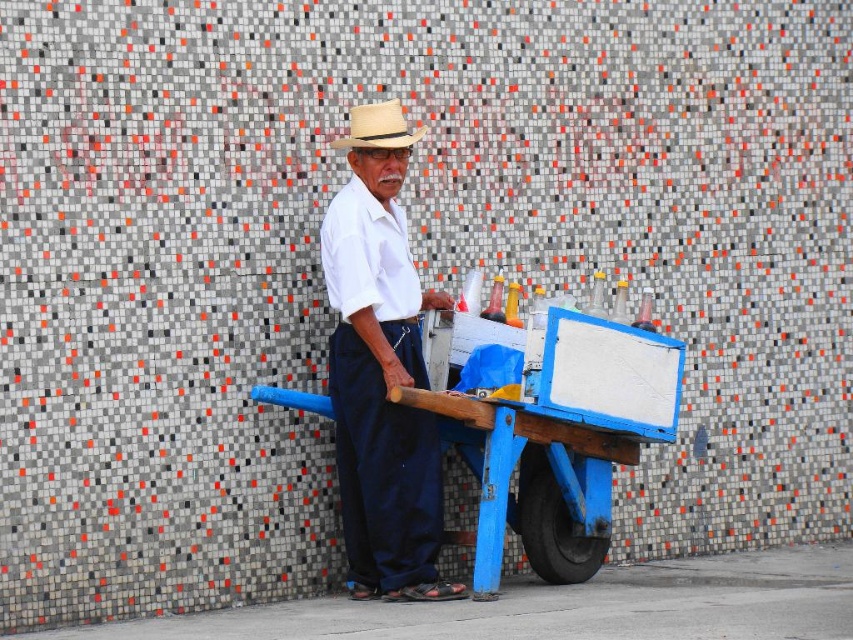
Question: Which point is farther to the camera?

Choices:
 (A) (343, 148)
 (B) (602, 387)

Answer: (A)

Question: Which point appears closest to the camera in this image?

Choices:
 (A) (376, 132)
 (B) (361, 424)

Answer: (B)

Question: Is blue painted wood cart at center bigger than white cotton shirt at center?

Choices:
 (A) no
 (B) yes

Answer: (B)

Question: Can you confirm if blue painted wood cart at center is bigger than white cotton shirt at center?

Choices:
 (A) yes
 (B) no

Answer: (A)

Question: Does blue painted wood cart at center come in front of white cotton shirt at center?

Choices:
 (A) no
 (B) yes

Answer: (B)

Question: Based on their relative distances, which object is farther from the beige straw fedora at center?

Choices:
 (A) blue painted wood cart at center
 (B) white cotton shirt at center

Answer: (A)